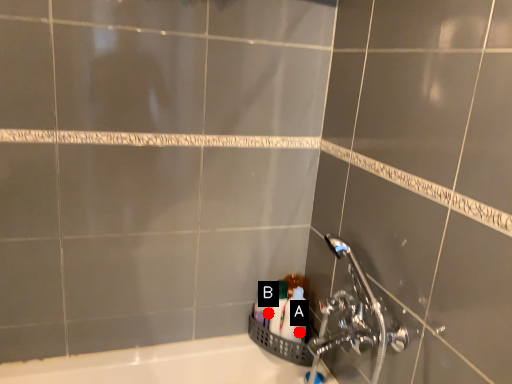
Question: Two points are circled on the image, labeled by A and B beside each circle. Among these points, which one is farthest from the camera?

Choices:
 (A) A is further
 (B) B is further

Answer: (B)